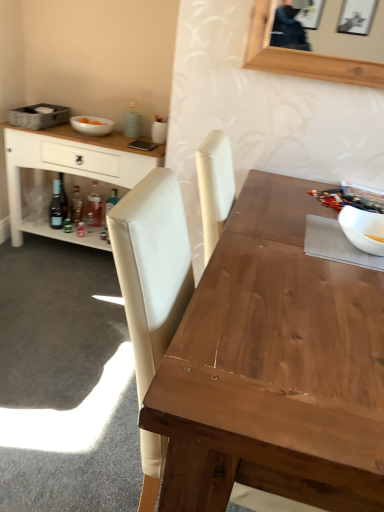
The width and height of the screenshot is (384, 512). What do you see at coordinates (274, 367) in the screenshot? I see `wooden table at center` at bounding box center [274, 367].

Identify the location of white glossy bowl at upper right, the second bowl in the top-to-bottom sequence. (363, 229).

What is the approximate width of matte glass bottle at lower left, the third bottle positioned from the right?

2.55 inches.

Image resolution: width=384 pixels, height=512 pixels. Find the location of `white glossy bowl at upper left, the second bowl positioned from the bottom`. white glossy bowl at upper left, the second bowl positioned from the bottom is located at coordinates [x=92, y=125].

Locate an element on the screen. The width and height of the screenshot is (384, 512). white wood cabinet at left is located at coordinates (71, 169).

I want to click on gray woven picnic basket at upper left, so click(39, 116).

Find the location of a particular element. translucent glass bottle at lower left, which appears as the 3th bottle when viewed from the left is located at coordinates (94, 206).

Where is `wooden table at center`? wooden table at center is located at coordinates (274, 367).

Does white glossy bowl at upper left, which is the 2th bowl from right to left, turn towards translucent glass bottle at lower left, marked as the second bottle in a left-to-right arrangement?

No, white glossy bowl at upper left, which is the 2th bowl from right to left, is not aimed at translucent glass bottle at lower left, marked as the second bottle in a left-to-right arrangement.

The height and width of the screenshot is (512, 384). I want to click on the 3rd bottle positioned below the white glossy bowl at upper left, which is the 2th bowl in front-to-back order (from the image's perspective), so click(76, 205).

Considering the sizes of objects white glossy bowl at upper left, which is the 2th bowl from right to left, and translucent glass bottle at lower left, the second bottle viewed from the right, in the image provided, who is wider, white glossy bowl at upper left, which is the 2th bowl from right to left, or translucent glass bottle at lower left, the second bottle viewed from the right,?

white glossy bowl at upper left, which is the 2th bowl from right to left, is wider.

From the image's perspective, would you say white glossy bowl at upper left, arranged as the 1th bowl when viewed from the back, is shown under translucent glass bottle at lower left, the second bottle viewed from the right?

Actually, white glossy bowl at upper left, arranged as the 1th bowl when viewed from the back, appears above translucent glass bottle at lower left, the second bottle viewed from the right, in the image.

Is white glossy bowl at upper left, which is the 2th bowl in front-to-back order, to the left of matte glass bottle at lower left, the third bottle positioned from the right, from the viewer's perspective?

No, white glossy bowl at upper left, which is the 2th bowl in front-to-back order, is not to the left of matte glass bottle at lower left, the third bottle positioned from the right.

The width and height of the screenshot is (384, 512). Find the location of `the 1st bowl in front of the matte glass bottle at lower left, the third bottle positioned from the right, starting your count from the anchor`. the 1st bowl in front of the matte glass bottle at lower left, the third bottle positioned from the right, starting your count from the anchor is located at coordinates (92, 125).

Is white glossy bowl at upper left, arranged as the 1th bowl when viewed from the back, not inside matte glass bottle at lower left, marked as the first bottle in a left-to-right arrangement?

Yes, white glossy bowl at upper left, arranged as the 1th bowl when viewed from the back, is not within matte glass bottle at lower left, marked as the first bottle in a left-to-right arrangement.

Considering the sizes of objects white glossy bowl at upper left, arranged as the 1th bowl when viewed from the back, and matte glass bottle at lower left, marked as the first bottle in a left-to-right arrangement, in the image provided, who is thinner, white glossy bowl at upper left, arranged as the 1th bowl when viewed from the back, or matte glass bottle at lower left, marked as the first bottle in a left-to-right arrangement,?

Thinner between the two is matte glass bottle at lower left, marked as the first bottle in a left-to-right arrangement.

From the image's perspective, who appears lower, translucent glass bottle at lower left, which appears as the 3th bottle when viewed from the left, or matte glass bottle at lower left, the third bottle positioned from the right?

matte glass bottle at lower left, the third bottle positioned from the right.

Is translucent glass bottle at lower left, which is counted as the first bottle, starting from the right, oriented away from matte glass bottle at lower left, marked as the first bottle in a left-to-right arrangement?

No, translucent glass bottle at lower left, which is counted as the first bottle, starting from the right, is not facing away from matte glass bottle at lower left, marked as the first bottle in a left-to-right arrangement.

Considering the sizes of objects translucent glass bottle at lower left, which is counted as the first bottle, starting from the right, and matte glass bottle at lower left, marked as the first bottle in a left-to-right arrangement, in the image provided, who is wider, translucent glass bottle at lower left, which is counted as the first bottle, starting from the right, or matte glass bottle at lower left, marked as the first bottle in a left-to-right arrangement,?

Wider between the two is matte glass bottle at lower left, marked as the first bottle in a left-to-right arrangement.

Would you say translucent glass bottle at lower left, which appears as the 3th bottle when viewed from the left, is to the left or to the right of matte glass bottle at lower left, marked as the first bottle in a left-to-right arrangement, in the picture?

translucent glass bottle at lower left, which appears as the 3th bottle when viewed from the left, is positioned on matte glass bottle at lower left, marked as the first bottle in a left-to-right arrangement,'s right side.

How many degrees apart are the facing directions of gray woven picnic basket at upper left and white glossy bowl at upper right, the second bowl in the top-to-bottom sequence?

There is a 0.248-degree angle between the facing directions of gray woven picnic basket at upper left and white glossy bowl at upper right, the second bowl in the top-to-bottom sequence.

Is point (33, 128) closer to viewer compared to point (344, 231)?

No.

From a real-world perspective, between gray woven picnic basket at upper left and white glossy bowl at upper right, which is the first bowl from front to back, who is vertically higher?

From a 3D spatial view, white glossy bowl at upper right, which is the first bowl from front to back, is above.

Who is bigger, gray woven picnic basket at upper left or white glossy bowl at upper right, which is the first bowl from front to back?

gray woven picnic basket at upper left.

Does translucent glass bottle at lower left, the second bottle viewed from the right, have a smaller size compared to white wood cabinet at left?

Yes.

Which bottle is the 3rd one when counting from the back of the white wood cabinet at left? Please provide its 2D coordinates.

[(76, 205)]

Could you tell me if translucent glass bottle at lower left, marked as the second bottle in a left-to-right arrangement, is facing white wood cabinet at left?

Yes, translucent glass bottle at lower left, marked as the second bottle in a left-to-right arrangement, is oriented towards white wood cabinet at left.

Are gray woven picnic basket at upper left and matte glass bottle at lower left, the third bottle positioned from the right, located far from each other?

No, there isn't a large distance between gray woven picnic basket at upper left and matte glass bottle at lower left, the third bottle positioned from the right.

Where is `picnic basket lying on the left of matte glass bottle at lower left, the third bottle positioned from the right`? The height and width of the screenshot is (512, 384). picnic basket lying on the left of matte glass bottle at lower left, the third bottle positioned from the right is located at coordinates (39, 116).

Does gray woven picnic basket at upper left appear on the left side of matte glass bottle at lower left, the third bottle positioned from the right?

Indeed, gray woven picnic basket at upper left is positioned on the left side of matte glass bottle at lower left, the third bottle positioned from the right.

Does gray woven picnic basket at upper left have a greater width compared to matte glass bottle at lower left, the third bottle positioned from the right?

Yes.

Looking at this image, which is correct: white glossy bowl at upper right, which is the 2th bowl from left to right, is inside white glossy bowl at upper left, which is the 2th bowl in front-to-back order, or outside of it?

white glossy bowl at upper right, which is the 2th bowl from left to right, exists outside the volume of white glossy bowl at upper left, which is the 2th bowl in front-to-back order.

Looking at this image, can you confirm if white glossy bowl at upper right, which is the first bowl from front to back, is smaller than white glossy bowl at upper left, which is the 1th bowl in top-to-bottom order?

Yes, white glossy bowl at upper right, which is the first bowl from front to back, is smaller than white glossy bowl at upper left, which is the 1th bowl in top-to-bottom order.

Relative to white glossy bowl at upper left, the second bowl positioned from the bottom, is white glossy bowl at upper right, marked as the second bowl in a back-to-front arrangement, in front or behind?

Clearly, white glossy bowl at upper right, marked as the second bowl in a back-to-front arrangement, is in front of white glossy bowl at upper left, the second bowl positioned from the bottom.

Where is `bowl located above the translucent glass bottle at lower left, the second bottle viewed from the right (from the image's perspective)`? This screenshot has height=512, width=384. bowl located above the translucent glass bottle at lower left, the second bottle viewed from the right (from the image's perspective) is located at coordinates (92, 125).

I want to click on the 3rd bottle counting from the left of the white glossy bowl at upper left, arranged as the 1th bowl when viewed from the back, so click(56, 207).

In the scene shown: When comparing their distances from wooden table at center, does white glossy bowl at upper right, which is the first bowl from front to back, or translucent glass bottle at lower left, which appears as the 3th bottle when viewed from the left, seem further?

translucent glass bottle at lower left, which appears as the 3th bottle when viewed from the left, is positioned further to the anchor wooden table at center.

Estimate the real-world distances between objects in this image. Which object is closer to gray woven picnic basket at upper left, matte glass bottle at lower left, marked as the first bottle in a left-to-right arrangement, or wooden table at center?

matte glass bottle at lower left, marked as the first bottle in a left-to-right arrangement, is closer to gray woven picnic basket at upper left.

Based on their spatial positions, is translucent glass bottle at lower left, which appears as the 3th bottle when viewed from the left, or matte glass bottle at lower left, the third bottle positioned from the right, closer to gray woven picnic basket at upper left?

matte glass bottle at lower left, the third bottle positioned from the right.

From the image, which object appears to be nearer to matte glass bottle at lower left, marked as the first bottle in a left-to-right arrangement, translucent glass bottle at lower left, marked as the second bottle in a left-to-right arrangement, or white glossy bowl at upper right, which is the first bowl from front to back?

translucent glass bottle at lower left, marked as the second bottle in a left-to-right arrangement, is positioned closer to the anchor matte glass bottle at lower left, marked as the first bottle in a left-to-right arrangement.

From the image, which object appears to be nearer to translucent glass bottle at lower left, which appears as the 3th bottle when viewed from the left, white glossy bowl at upper left, which is the 2th bowl from right to left, or gray woven picnic basket at upper left?

white glossy bowl at upper left, which is the 2th bowl from right to left, is closer to translucent glass bottle at lower left, which appears as the 3th bottle when viewed from the left.

Estimate the real-world distances between objects in this image. Which object is closer to gray woven picnic basket at upper left, white wood cabinet at left or translucent glass bottle at lower left, which is counted as the first bottle, starting from the right?

white wood cabinet at left lies closer to gray woven picnic basket at upper left than the other object.

Considering their positions, is translucent glass bottle at lower left, marked as the second bottle in a left-to-right arrangement, positioned further to gray woven picnic basket at upper left than white glossy bowl at upper left, which is the 2th bowl in front-to-back order?

translucent glass bottle at lower left, marked as the second bottle in a left-to-right arrangement.

Looking at the image, which one is located further to matte glass bottle at lower left, the third bottle positioned from the right, gray woven picnic basket at upper left or white glossy bowl at upper left, which is the 2th bowl from right to left?

Among the two, white glossy bowl at upper left, which is the 2th bowl from right to left, is located further to matte glass bottle at lower left, the third bottle positioned from the right.

Where is `bottle between matte glass bottle at lower left, marked as the first bottle in a left-to-right arrangement, and translucent glass bottle at lower left, which is counted as the first bottle, starting from the right`? bottle between matte glass bottle at lower left, marked as the first bottle in a left-to-right arrangement, and translucent glass bottle at lower left, which is counted as the first bottle, starting from the right is located at coordinates click(76, 205).

Image resolution: width=384 pixels, height=512 pixels. I want to click on picnic basket between white wood cabinet at left and translucent glass bottle at lower left, the second bottle viewed from the right, in the front-back direction, so click(39, 116).

Find the location of a particular element. bowl between white glossy bowl at upper right, which is the 2th bowl from left to right, and translucent glass bottle at lower left, the second bottle viewed from the right, from front to back is located at coordinates (92, 125).

Where is `cabinetry between wooden table at center and translucent glass bottle at lower left, which is counted as the first bottle, starting from the right, along the z-axis`? Image resolution: width=384 pixels, height=512 pixels. cabinetry between wooden table at center and translucent glass bottle at lower left, which is counted as the first bottle, starting from the right, along the z-axis is located at coordinates (71, 169).